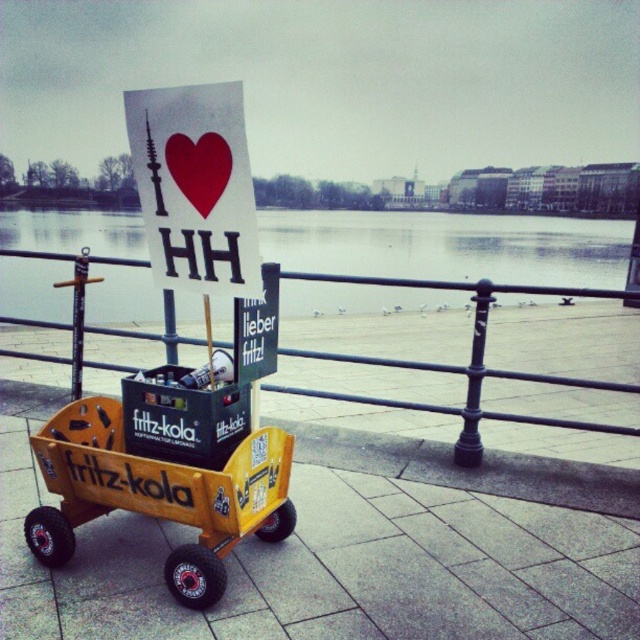
Question: Considering the relative positions of yellow wood cart at center and yellow plastic cart at center in the image provided, where is yellow wood cart at center located with respect to yellow plastic cart at center?

Choices:
 (A) left
 (B) right

Answer: (B)

Question: Does yellow plastic cart at center appear over matte paper heart at center?

Choices:
 (A) yes
 (B) no

Answer: (B)

Question: Estimate the real-world distances between objects in this image. Which object is farther from the yellow plastic cart at center?

Choices:
 (A) white paper sign at upper center
 (B) black cardboard crate at center

Answer: (A)

Question: Based on their relative distances, which object is nearer to the yellow wood cart at center?

Choices:
 (A) transparent water at center
 (B) matte paper heart at center
 (C) green matte sign at center

Answer: (C)

Question: Which is nearer to the matte paper heart at center?

Choices:
 (A) black cardboard crate at center
 (B) yellow plastic cart at center
 (C) yellow wood cart at center
 (D) white paper sign at upper center

Answer: (D)

Question: Can you confirm if transparent water at center is bigger than yellow plastic cart at center?

Choices:
 (A) no
 (B) yes

Answer: (B)